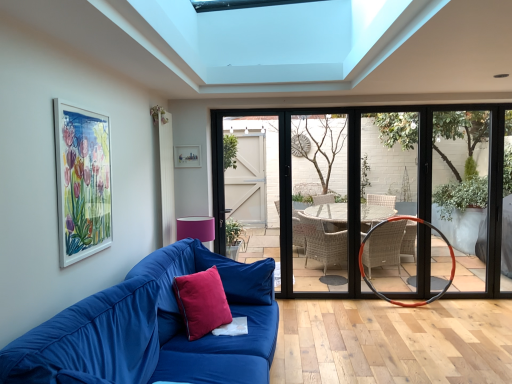
Measure the distance between point [202,292] and camera.

The distance of point [202,292] from camera is 8.99 feet.

What is the approximate width of matte wooden picture frame at upper center, which appears as the 1th picture frame when viewed from the right?

1.46 inches.

In order to face orange rubber basketball hoop at right, should I rotate leftwards or rightwards?

Turn right by 19.524 degrees to look at orange rubber basketball hoop at right.

This screenshot has width=512, height=384. I want to click on velvet red pillow at lower left, positioned as the 1th pillow in back-to-front order, so click(x=239, y=276).

What are the coordinates of `velvet blue couch at lower left` in the screenshot? It's located at (152, 329).

Based on the photo, is matte black door at center in front of velvet blue couch at lower left?

No, the depth of matte black door at center is greater than that of velvet blue couch at lower left.

Image resolution: width=512 pixels, height=384 pixels. Find the location of `door to the right of velvet blue couch at lower left`. door to the right of velvet blue couch at lower left is located at coordinates (384, 187).

Considering the positions of point (221, 290) and point (176, 167), is point (221, 290) closer or farther from the camera than point (176, 167)?

Clearly, point (221, 290) is closer to the camera than point (176, 167).

From the image's perspective, is satin red pillow at center, acting as the first pillow starting from the front, on top of matte wooden picture frame at upper center, positioned as the second picture frame in front-to-back order?

Incorrect, from the image's perspective, satin red pillow at center, acting as the first pillow starting from the front, is lower than matte wooden picture frame at upper center, positioned as the second picture frame in front-to-back order.

Can you see satin red pillow at center, acting as the second pillow starting from the back, touching matte wooden picture frame at upper center, which is counted as the 1th picture frame, starting from the back?

satin red pillow at center, acting as the second pillow starting from the back, is not next to matte wooden picture frame at upper center, which is counted as the 1th picture frame, starting from the back, and they're not touching.

From the image's perspective, is satin red pillow at center, acting as the first pillow starting from the front, located beneath velvet blue couch at lower left?

No, from the image's perspective, satin red pillow at center, acting as the first pillow starting from the front, is not below velvet blue couch at lower left.

In terms of width, does satin red pillow at center, acting as the first pillow starting from the front, look wider or thinner when compared to velvet blue couch at lower left?

In the image, satin red pillow at center, acting as the first pillow starting from the front, appears to be more narrow than velvet blue couch at lower left.

Is velvet blue couch at lower left at the back of satin red pillow at center, acting as the second pillow starting from the back?

Yes, velvet blue couch at lower left is at the back of satin red pillow at center, acting as the second pillow starting from the back.

In the scene shown: Are satin red pillow at center, acting as the first pillow starting from the front, and velvet blue couch at lower left far apart?

No, satin red pillow at center, acting as the first pillow starting from the front, is not far from velvet blue couch at lower left.

From a real-world perspective, which object rests below the other?

In real-world perspective, velvet red pillow at lower left, which ranks as the 2th pillow in front-to-back order, is lower.

Considering the sizes of objects matte wooden picture frame at upper center, positioned as the second picture frame in front-to-back order, and velvet red pillow at lower left, positioned as the 1th pillow in back-to-front order, in the image provided, who is bigger, matte wooden picture frame at upper center, positioned as the second picture frame in front-to-back order, or velvet red pillow at lower left, positioned as the 1th pillow in back-to-front order,?

Bigger between the two is velvet red pillow at lower left, positioned as the 1th pillow in back-to-front order.

Does matte wooden picture frame at upper center, which is counted as the 1th picture frame, starting from the back, contain velvet red pillow at lower left, positioned as the 1th pillow in back-to-front order?

That's incorrect, velvet red pillow at lower left, positioned as the 1th pillow in back-to-front order, is not inside matte wooden picture frame at upper center, which is counted as the 1th picture frame, starting from the back.

Can you confirm if matte wooden picture frame at upper center, which ranks as the second picture frame in left-to-right order, is wider than velvet red pillow at lower left, positioned as the 1th pillow in back-to-front order?

In fact, matte wooden picture frame at upper center, which ranks as the second picture frame in left-to-right order, might be narrower than velvet red pillow at lower left, positioned as the 1th pillow in back-to-front order.

Is matte black door at center further to the viewer compared to matte wooden picture frame at upper center, which is counted as the 1th picture frame, starting from the back?

Yes, it is behind matte wooden picture frame at upper center, which is counted as the 1th picture frame, starting from the back.

Which point is more distant from viewer, (334, 149) or (183, 162)?

Point (334, 149)

Is matte black door at center completely or partially outside of matte wooden picture frame at upper center, which ranks as the second picture frame in left-to-right order?

matte black door at center is positioned outside matte wooden picture frame at upper center, which ranks as the second picture frame in left-to-right order.

From a real-world perspective, between satin red pillow at center, acting as the first pillow starting from the front, and velvet red pillow at lower left, which ranks as the 2th pillow in front-to-back order, who is vertically lower?

satin red pillow at center, acting as the first pillow starting from the front.

Consider the image. In terms of width, does satin red pillow at center, acting as the first pillow starting from the front, look wider or thinner when compared to velvet red pillow at lower left, which ranks as the 2th pillow in front-to-back order?

Considering their sizes, satin red pillow at center, acting as the first pillow starting from the front, looks slimmer than velvet red pillow at lower left, which ranks as the 2th pillow in front-to-back order.

Can you confirm if satin red pillow at center, acting as the first pillow starting from the front, is bigger than velvet red pillow at lower left, which ranks as the 2th pillow in front-to-back order?

Incorrect, satin red pillow at center, acting as the first pillow starting from the front, is not larger than velvet red pillow at lower left, which ranks as the 2th pillow in front-to-back order.

Where is `pillow that is under the velvet red pillow at lower left, positioned as the 1th pillow in back-to-front order (from a real-world perspective)`? pillow that is under the velvet red pillow at lower left, positioned as the 1th pillow in back-to-front order (from a real-world perspective) is located at coordinates (202, 302).

From the image's perspective, is velvet red pillow at lower left, which ranks as the 2th pillow in front-to-back order, above or below satin red pillow at center, acting as the second pillow starting from the back?

Clearly, from the image's perspective, velvet red pillow at lower left, which ranks as the 2th pillow in front-to-back order, is above satin red pillow at center, acting as the second pillow starting from the back.

Is point (247, 296) closer to viewer compared to point (204, 296)?

No, (247, 296) is behind (204, 296).

Where is `door above the velvet blue couch at lower left (from the image's perspective)`? The image size is (512, 384). door above the velvet blue couch at lower left (from the image's perspective) is located at coordinates (384, 187).

Where is `pillow that is the 2nd one when counting downward from the matte wooden picture frame at upper center, which ranks as the second picture frame in left-to-right order (from the image's perspective)`? The width and height of the screenshot is (512, 384). pillow that is the 2nd one when counting downward from the matte wooden picture frame at upper center, which ranks as the second picture frame in left-to-right order (from the image's perspective) is located at coordinates (202, 302).

Which object lies nearer to the anchor point velvet red pillow at lower left, positioned as the 1th pillow in back-to-front order, matte black door at center or matte wooden picture frame at upper center, which appears as the 1th picture frame when viewed from the right?

matte wooden picture frame at upper center, which appears as the 1th picture frame when viewed from the right.

Estimate the real-world distances between objects in this image. Which object is closer to satin red pillow at center, acting as the second pillow starting from the back, white glossy picture frame at upper left, placed as the 2th picture frame when sorted from back to front, or matte black door at center?

The object closer to satin red pillow at center, acting as the second pillow starting from the back, is white glossy picture frame at upper left, placed as the 2th picture frame when sorted from back to front.

Estimate the real-world distances between objects in this image. Which object is further from matte wooden picture frame at upper center, which is counted as the 1th picture frame, starting from the back, orange rubber basketball hoop at right or matte black door at center?

The object further to matte wooden picture frame at upper center, which is counted as the 1th picture frame, starting from the back, is orange rubber basketball hoop at right.

Considering their positions, is matte wooden picture frame at upper center, positioned as the second picture frame in front-to-back order, positioned closer to orange rubber basketball hoop at right than matte black door at center?

matte black door at center lies closer to orange rubber basketball hoop at right than the other object.

Considering their positions, is orange rubber basketball hoop at right positioned closer to matte black door at center than white glossy picture frame at upper left, the 1th picture frame when ordered from left to right?

orange rubber basketball hoop at right.

Considering their positions, is satin red pillow at center, acting as the first pillow starting from the front, positioned closer to velvet red pillow at lower left, which ranks as the 2th pillow in front-to-back order, than white glossy picture frame at upper left, placed as the 2th picture frame when sorted from back to front?

satin red pillow at center, acting as the first pillow starting from the front, is positioned closer to the anchor velvet red pillow at lower left, which ranks as the 2th pillow in front-to-back order.

Which object lies further to the anchor point satin red pillow at center, acting as the second pillow starting from the back, matte black door at center or orange rubber basketball hoop at right?

The object further to satin red pillow at center, acting as the second pillow starting from the back, is matte black door at center.

When comparing their distances from matte wooden picture frame at upper center, positioned as the second picture frame in front-to-back order, does velvet red pillow at lower left, positioned as the 1th pillow in back-to-front order, or white glossy picture frame at upper left, placed as the 2th picture frame when sorted from back to front, seem further?

Among the two, white glossy picture frame at upper left, placed as the 2th picture frame when sorted from back to front, is located further to matte wooden picture frame at upper center, positioned as the second picture frame in front-to-back order.

The height and width of the screenshot is (384, 512). In order to click on pillow located between satin red pillow at center, acting as the second pillow starting from the back, and matte black door at center in the depth direction in this screenshot , I will do `click(239, 276)`.

What are the coordinates of `pillow positioned between velvet blue couch at lower left and velvet red pillow at lower left, which ranks as the 2th pillow in front-to-back order, from near to far` in the screenshot? It's located at (202, 302).

Where is `picture frame located between white glossy picture frame at upper left, which is the 2th picture frame in right-to-left order, and orange rubber basketball hoop at right in the left-right direction`? This screenshot has height=384, width=512. picture frame located between white glossy picture frame at upper left, which is the 2th picture frame in right-to-left order, and orange rubber basketball hoop at right in the left-right direction is located at coordinates (187, 156).

I want to click on picture frame positioned between velvet blue couch at lower left and satin red pillow at center, acting as the first pillow starting from the front, from near to far, so click(x=82, y=182).